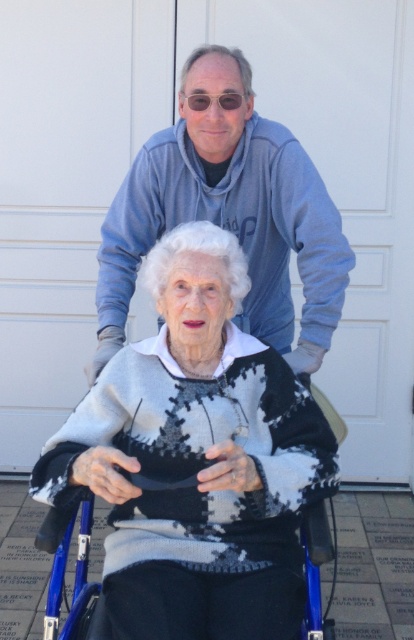
Between knitted sweater at center and matte blue hoodie at upper center, which one appears on the left side from the viewer's perspective?

Positioned to the left is matte blue hoodie at upper center.

Who is shorter, knitted sweater at center or matte blue hoodie at upper center?

With less height is matte blue hoodie at upper center.

Is point (301, 488) farther from viewer compared to point (216, 141)?

That is False.

Locate an element on the screen. The height and width of the screenshot is (640, 414). knitted sweater at center is located at coordinates [195, 460].

Can you confirm if knitted sweater at center is positioned below blue plastic wheelchair at center?

Incorrect, knitted sweater at center is not positioned below blue plastic wheelchair at center.

Can you confirm if knitted sweater at center is smaller than blue plastic wheelchair at center?

Actually, knitted sweater at center might be larger than blue plastic wheelchair at center.

Who is more forward, (195, 305) or (53, 579)?

Point (195, 305)

Image resolution: width=414 pixels, height=640 pixels. I want to click on knitted sweater at center, so click(195, 460).

Is matte blue hoodie at upper center to the left of blue plastic wheelchair at center from the viewer's perspective?

No, matte blue hoodie at upper center is not to the left of blue plastic wheelchair at center.

Is point (324, 232) closer to camera compared to point (337, 426)?

Yes, point (324, 232) is closer to viewer.

At what (x,y) coordinates should I click in order to perform the action: click on matte blue hoodie at upper center. Please return your answer as a coordinate pair (x, y). Looking at the image, I should click on (228, 211).